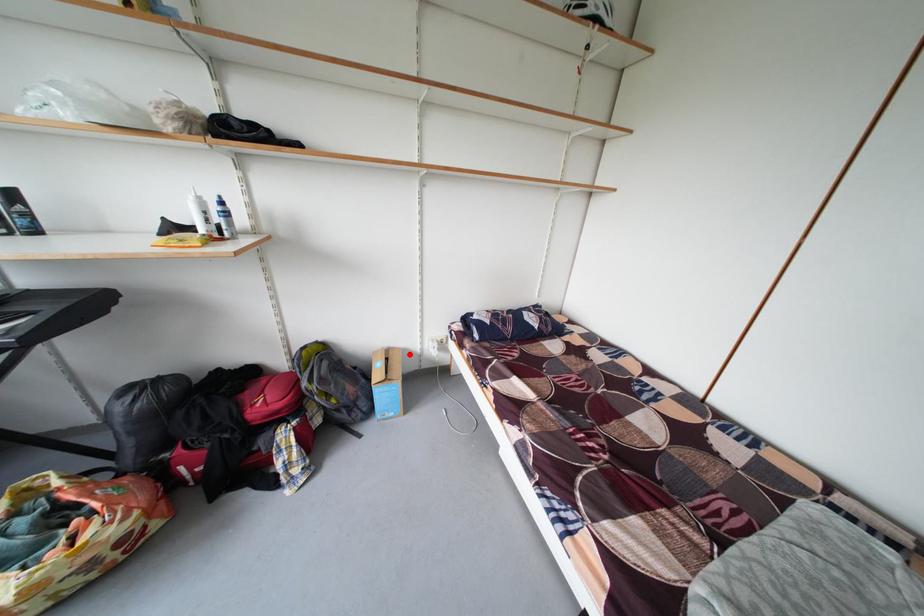
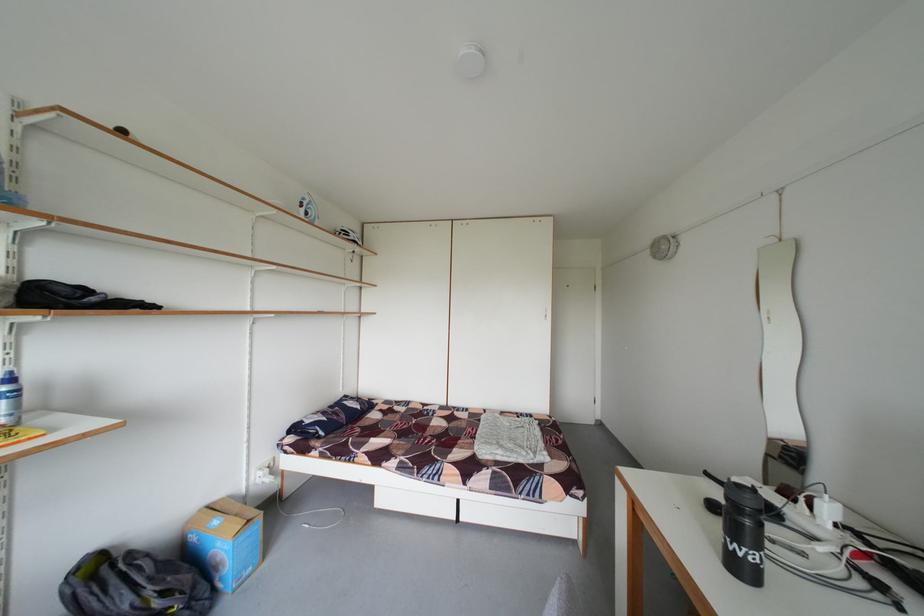
Question: A red point is marked in image1. In image2, is the corresponding 3D point closer to the camera or farther? Reply with the corresponding letter.

Choices:
 (A) The corresponding 3D point is closer.
 (B) The corresponding 3D point is farther.

Answer: (A)